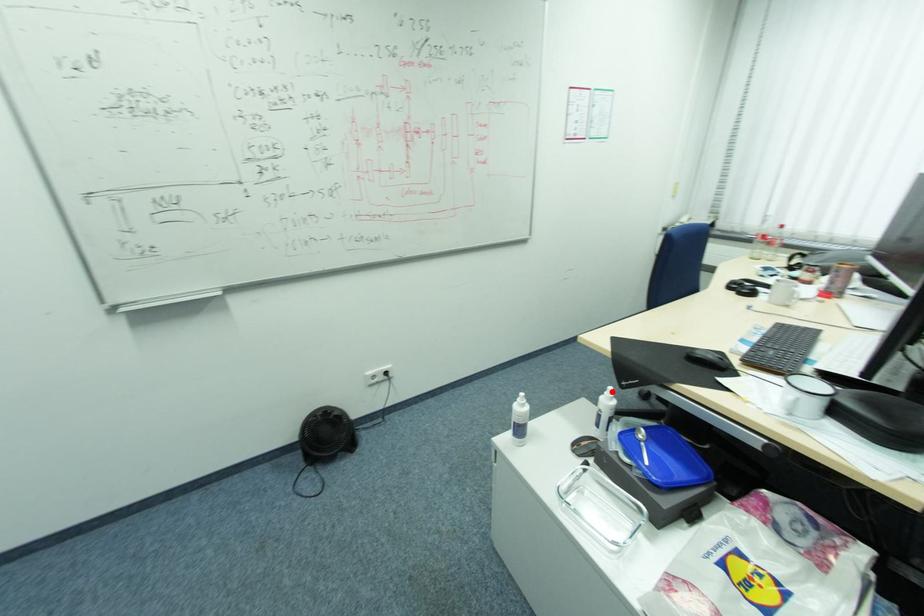
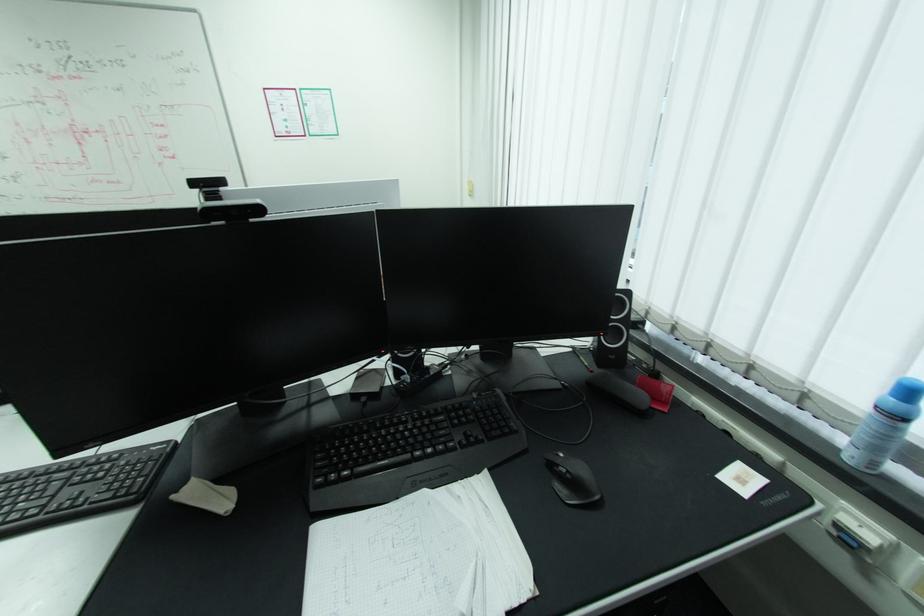
Question: I am providing you with two images of the same scene from different viewpoints. A red point is marked on the first image. Can you still see the location of the red point in image 2?

Choices:
 (A) Yes
 (B) No

Answer: (B)